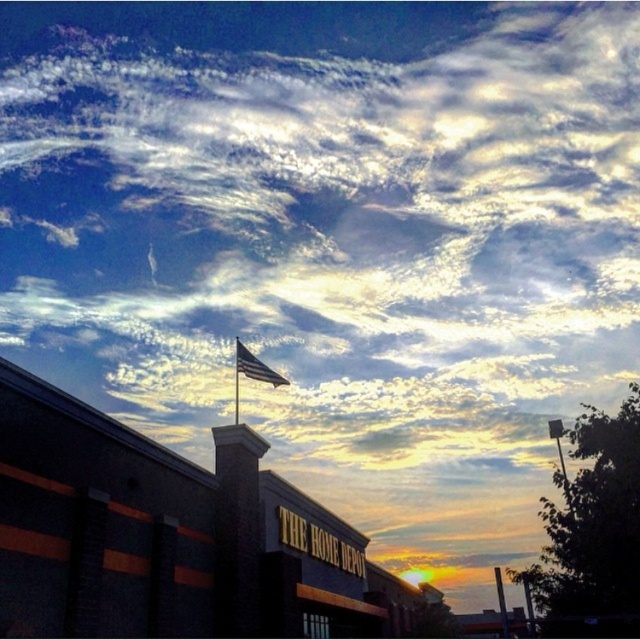
You are a customer standing at the entrance of the Home Depot store. You see an American flag at center and a metallic pole at right. Which object is closer to you?

The American flag at center is closer to you because it is positioned over the metallic pole at right, indicating it is in front.

You are a drone operator who needs to fly a drone from the Home Depot building to the american flag at center. Based on the coordinates provided, in which direction should you fly the drone to reach the flag?

The american flag at center is located at coordinates point (256,365). Since the Home Depot building is in the foreground and the flag is at the center, the drone should fly towards the center of the image to reach the american flag at center.